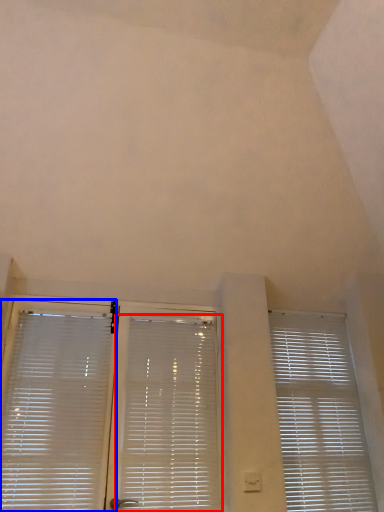
Question: Which object is closer to the camera taking this photo, window blind (highlighted by a red box) or window blind (highlighted by a blue box)?

Choices:
 (A) window blind
 (B) window blind

Answer: (B)